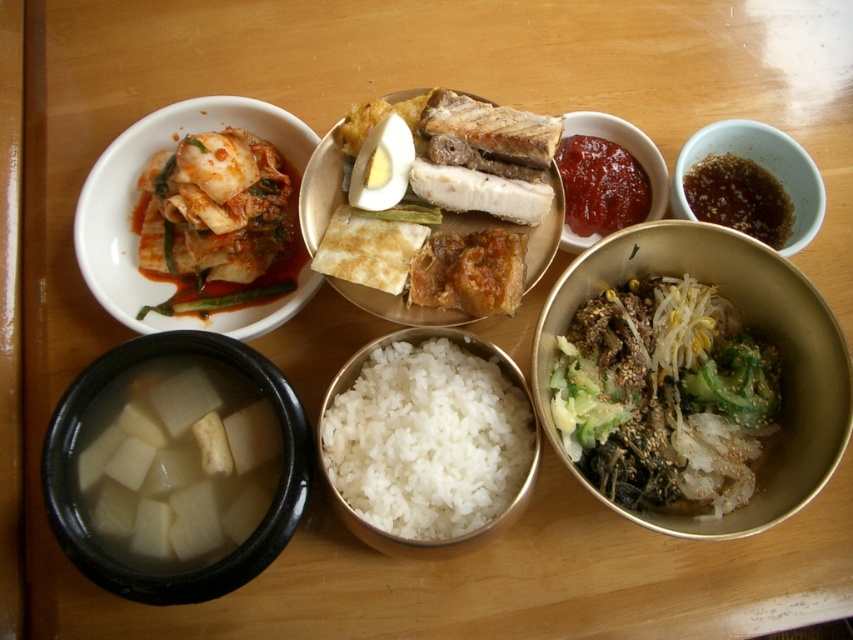
Question: Is white polished rice at center wider than smooth red paste at center?

Choices:
 (A) yes
 (B) no

Answer: (A)

Question: Which is nearer to the matte white kimchi at upper left?

Choices:
 (A) white polished rice at center
 (B) sesame-coated mixed vegetables at center-right
 (C) shiny brown sauce at upper right

Answer: (A)

Question: Which point is farther to the camera?

Choices:
 (A) smooth red paste at center
 (B) white polished rice at center

Answer: (A)

Question: Estimate the real-world distances between objects in this image. Which object is farther from the sesame-coated mixed vegetables at center-right?

Choices:
 (A) matte white kimchi at upper left
 (B) smooth red paste at center
 (C) golden brown crispy fried pork belly at center

Answer: (A)

Question: Can you confirm if sesame-coated mixed vegetables at center-right is smaller than white polished rice at center?

Choices:
 (A) no
 (B) yes

Answer: (A)

Question: Does white polished rice at center appear over smooth red paste at center?

Choices:
 (A) yes
 (B) no

Answer: (B)